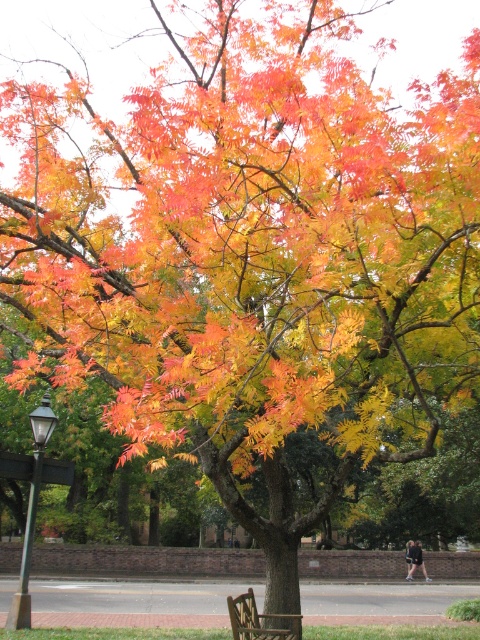
Question: Among these objects, which one is farthest from the camera?

Choices:
 (A) green metal lamp post at left
 (B) wooden park bench at lower center

Answer: (A)

Question: Is green metal lamp post at left to the left of wooden park bench at lower center from the viewer's perspective?

Choices:
 (A) no
 (B) yes

Answer: (B)

Question: Is the position of green metal lamp post at left less distant than that of wooden park bench at lower center?

Choices:
 (A) no
 (B) yes

Answer: (A)

Question: Which of the following is the closest to the observer?

Choices:
 (A) click(x=45, y=458)
 (B) click(x=257, y=627)

Answer: (B)

Question: Does green metal lamp post at left lie in front of wooden park bench at lower center?

Choices:
 (A) no
 (B) yes

Answer: (A)